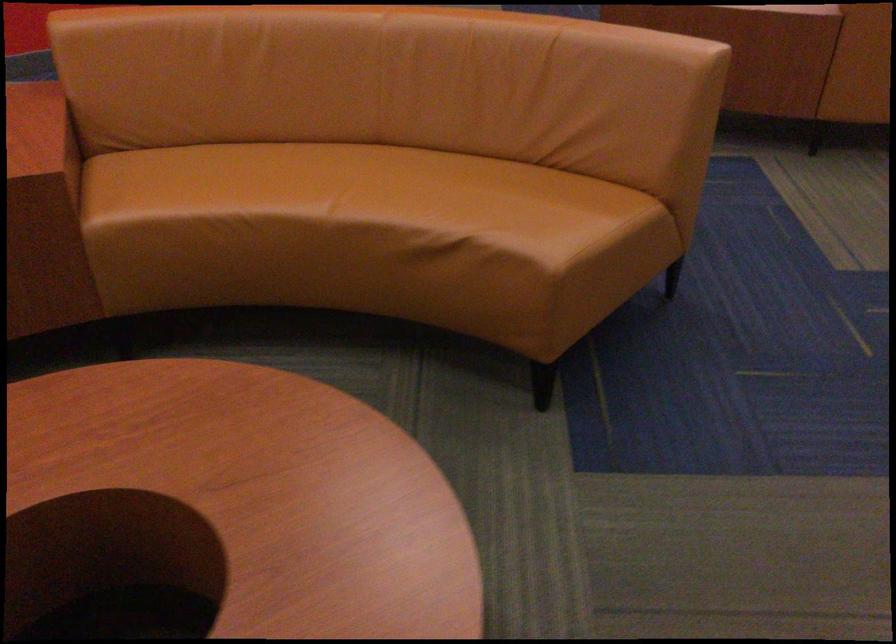
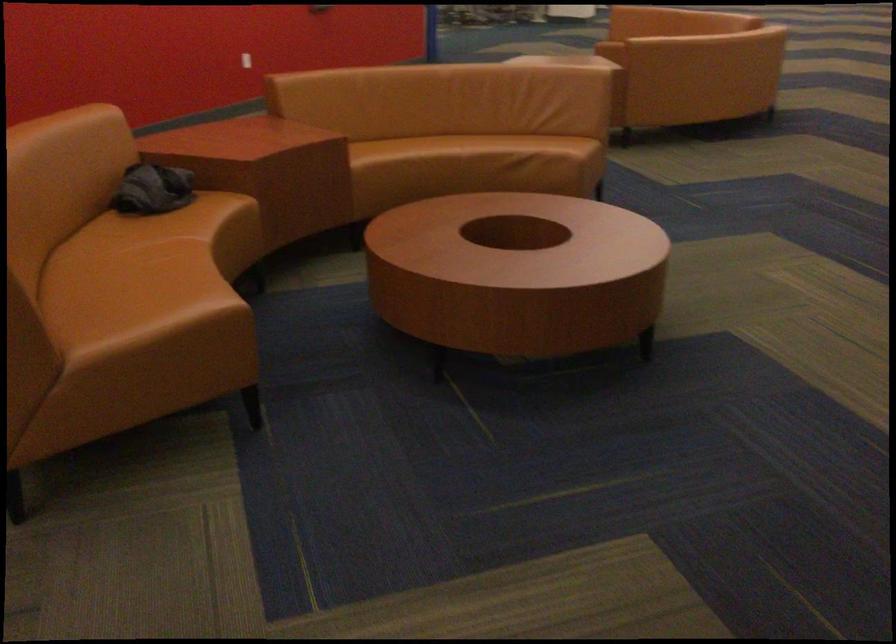
In a continuous first-person perspective shot, in which direction is the camera moving?

The cameraman moved toward left, backward.